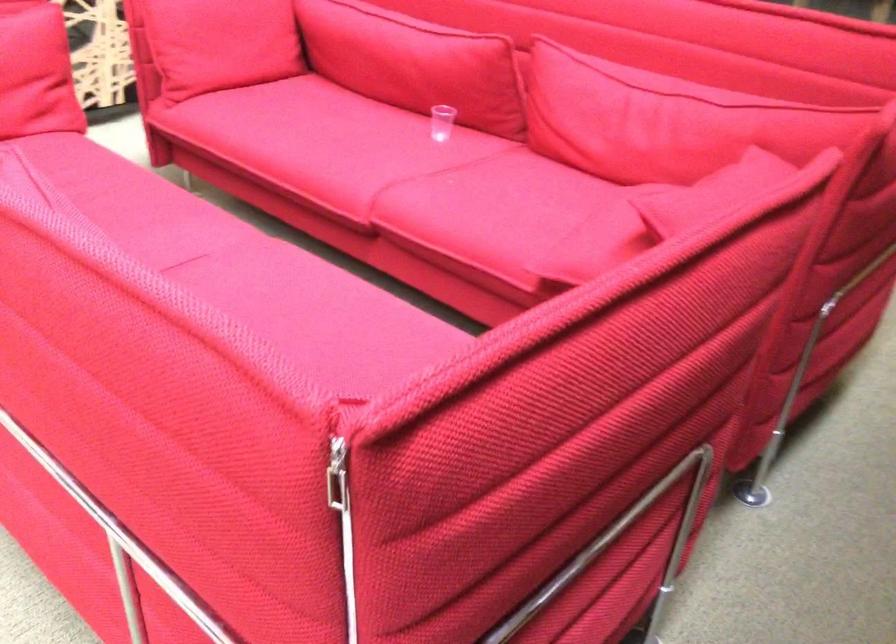
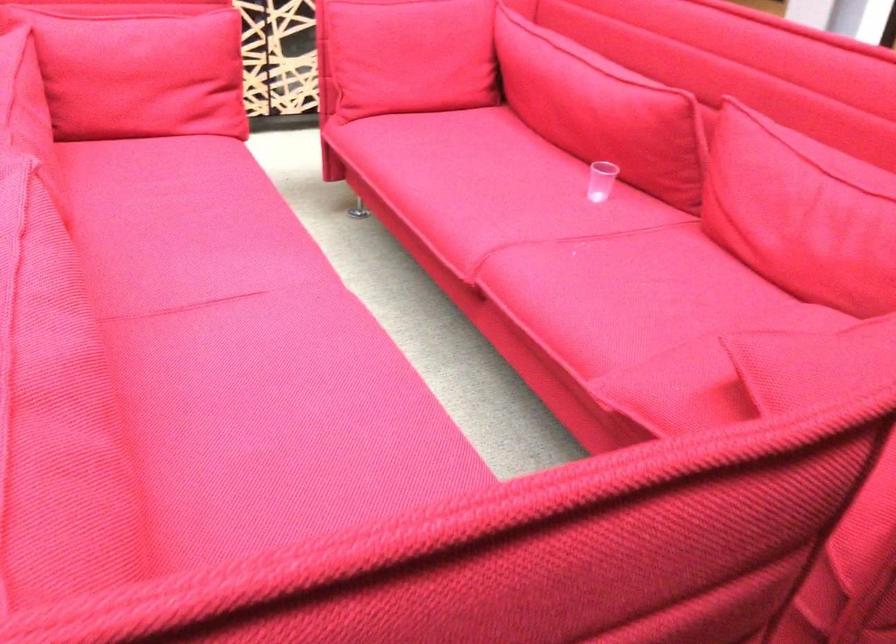
Locate, in the second image, the point that corresponds to point 218,289 in the first image.

(243, 337)